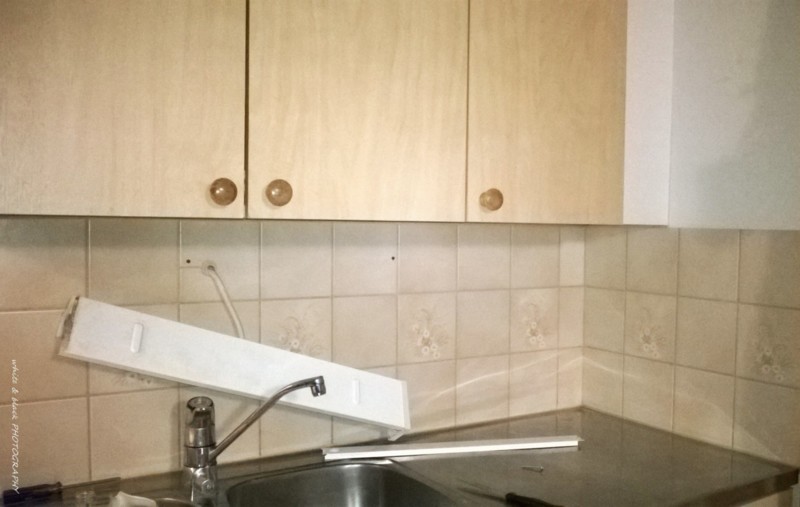
This screenshot has height=507, width=800. What are the coordinates of `counter` in the screenshot? It's located at [x=686, y=458].